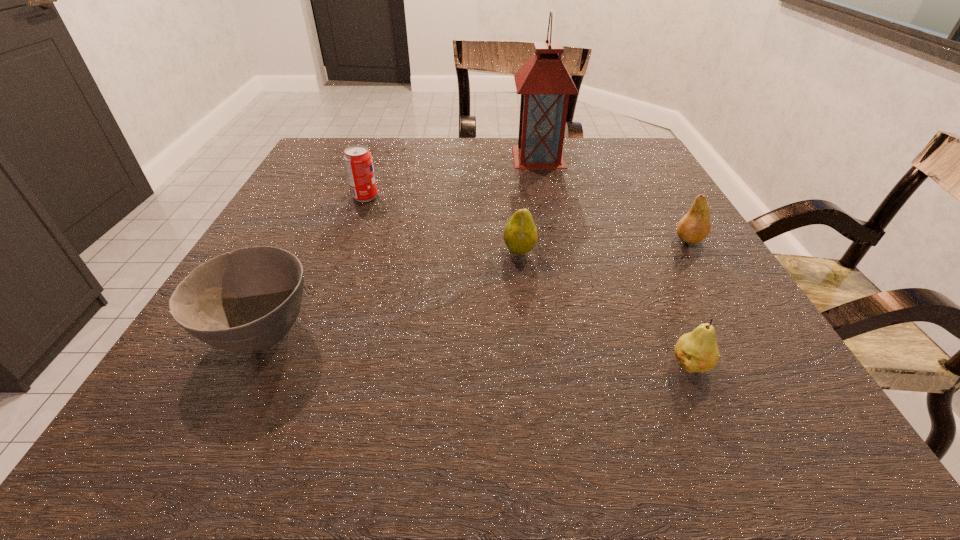
Identify the location of lantern. (544, 83).

You are a GUI agent. You are given a task and a screenshot of the screen. Output one action in this format:
    pyautogui.click(x=<x>, y=<y>)
    Task: Click on the tallest object
    Image resolution: width=960 pixels, height=540 pixels.
    Given the screenshot: What is the action you would take?
    pyautogui.click(x=544, y=83)

Image resolution: width=960 pixels, height=540 pixels. What are the coordinates of `soda can` in the screenshot? It's located at (358, 161).

Locate an element on the screen. Image resolution: width=960 pixels, height=540 pixels. the rightmost object is located at coordinates coord(695,226).

Where is `the leftmost pear`? the leftmost pear is located at coordinates (520, 235).

This screenshot has width=960, height=540. What are the coordinates of `bowl` in the screenshot? It's located at [x=247, y=300].

The width and height of the screenshot is (960, 540). What are the coordinates of `the second pear from right to left` in the screenshot? It's located at (697, 351).

Where is `the nearest pear`? The height and width of the screenshot is (540, 960). the nearest pear is located at coordinates (697, 351).

Image resolution: width=960 pixels, height=540 pixels. Find the location of `free space located 0.050m on the right of the lantern`. free space located 0.050m on the right of the lantern is located at coordinates (584, 157).

At what (x,y) coordinates should I click in order to perform the action: click on vacant space located 0.130m on the back of the soda can. Please return your answer as a coordinate pair (x, y). This screenshot has height=540, width=960. Looking at the image, I should click on (377, 165).